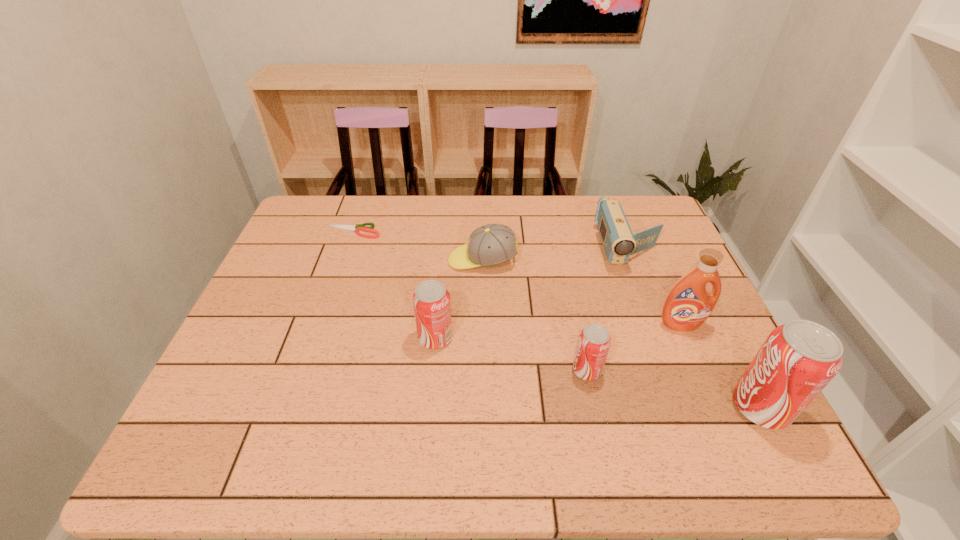
You are a GUI agent. You are given a task and a screenshot of the screen. Output one action in this format:
    pyautogui.click(x=<x>, y=<y>)
    Task: Click on the vacant space located 0.130m on the side of the camcorder with the flip-out screen
    This screenshot has height=540, width=960.
    Given the screenshot: What is the action you would take?
    pyautogui.click(x=652, y=310)

Identify the location of free space located on the front-facing side of the baseball cap. The width and height of the screenshot is (960, 540). (383, 260).

Where is `free space located on the front-facing side of the baseball cap`? The image size is (960, 540). free space located on the front-facing side of the baseball cap is located at coordinates (407, 260).

I want to click on free space located on the front-facing side of the baseball cap, so pyautogui.click(x=342, y=260).

The width and height of the screenshot is (960, 540). I want to click on vacant space located 0.330m on the front of the shortest object, so click(x=323, y=319).

Where is `vacant space located on the front-facing side of the detergent`? Image resolution: width=960 pixels, height=540 pixels. vacant space located on the front-facing side of the detergent is located at coordinates (699, 365).

This screenshot has height=540, width=960. Find the location of `camcorder that is at the far edge`. camcorder that is at the far edge is located at coordinates (619, 243).

Where is `scissors located in the far edge section of the desktop`? scissors located in the far edge section of the desktop is located at coordinates (359, 227).

Where is `object situated at the left edge`? object situated at the left edge is located at coordinates (359, 227).

Locate an element on the screen. The image size is (960, 540). soda can that is at the right edge is located at coordinates (798, 359).